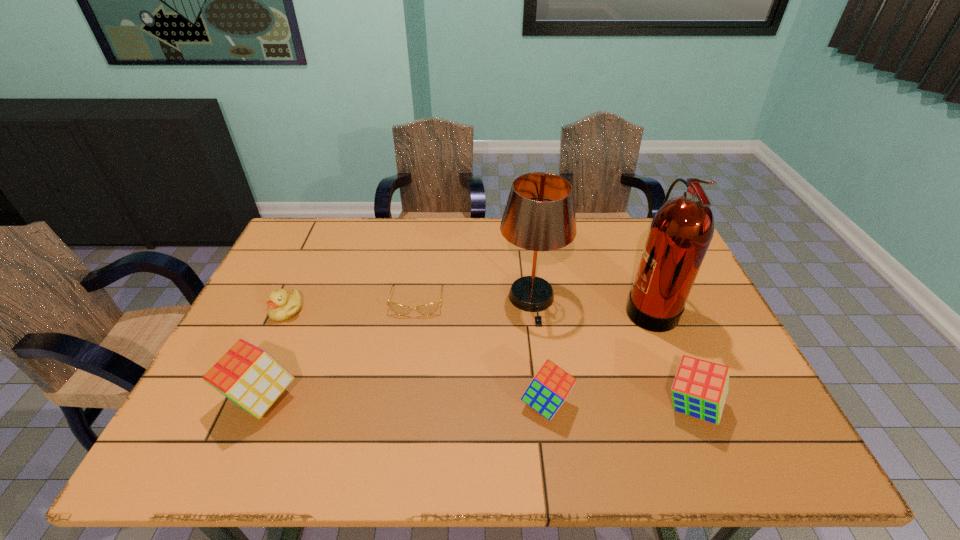
Find the location of a particular element. The height and width of the screenshot is (540, 960). object that stands as the fourth closest to the fourth tallest object is located at coordinates (427, 309).

Locate an element on the screen. The width and height of the screenshot is (960, 540). cube that stands as the third closest to the lampshade is located at coordinates (250, 377).

Select which cube is the closest to the lampshade. Please provide its 2D coordinates. Your answer should be formatted as a tuple, i.e. [(x, y)], where the tuple contains the x and y coordinates of a point satisfying the conditions above.

[(549, 388)]

Find the location of a particular element. vacant area in the image that satisfies the following two spatial constraints: 1. on the front-facing side of the shortest object; 2. on the right side of the fifth tallest object is located at coordinates [x=400, y=403].

Find the location of a particular element. This screenshot has height=540, width=960. free space that satisfies the following two spatial constraints: 1. on the front-facing side of the fire extinguisher; 2. on the right side of the rightmost cube is located at coordinates (689, 406).

Find the location of `vacant space that satisfies the following two spatial constraints: 1. on the front-facing side of the leftmost cube; 2. on the left side of the sixth tallest object`. vacant space that satisfies the following two spatial constraints: 1. on the front-facing side of the leftmost cube; 2. on the left side of the sixth tallest object is located at coordinates (246, 398).

The image size is (960, 540). What are the coordinates of `vacant space that satisfies the following two spatial constraints: 1. on the front-facing side of the fire extinguisher; 2. on the back side of the rightmost cube` in the screenshot? It's located at tap(689, 406).